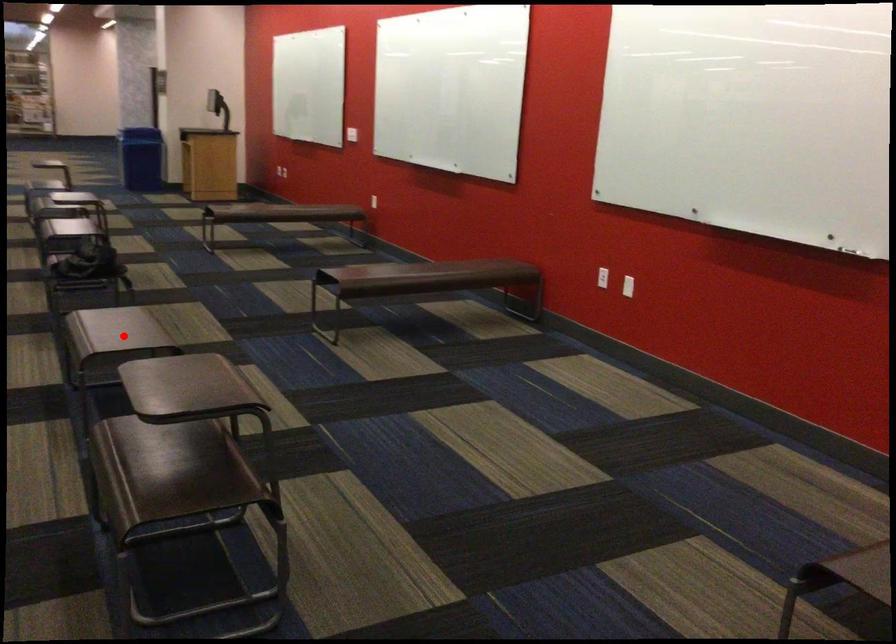
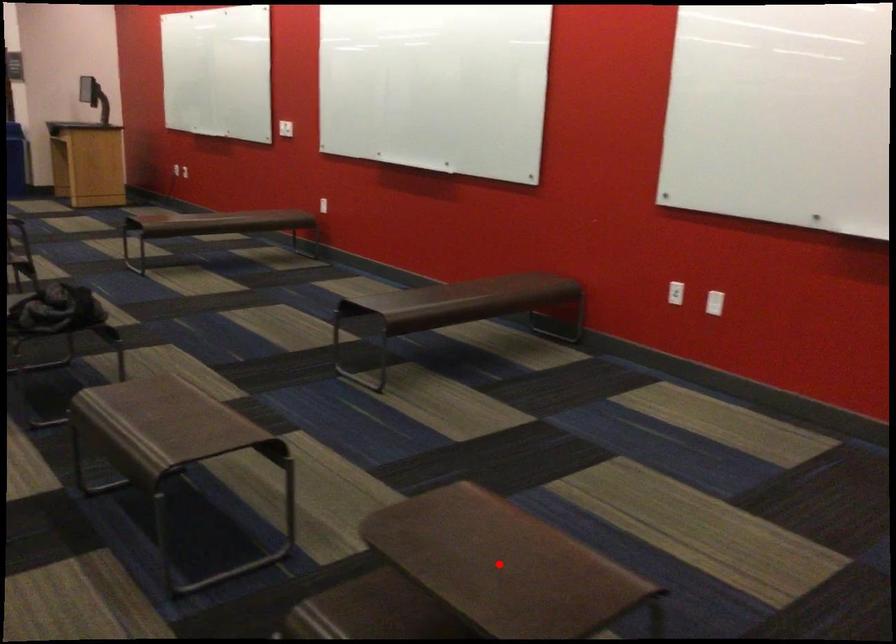
I am providing you with two images of the same scene from different viewpoints. A red point is marked on the first image and another point is marked on the second image. Is the marked point in image1 the same physical position as the marked point in image2?

No